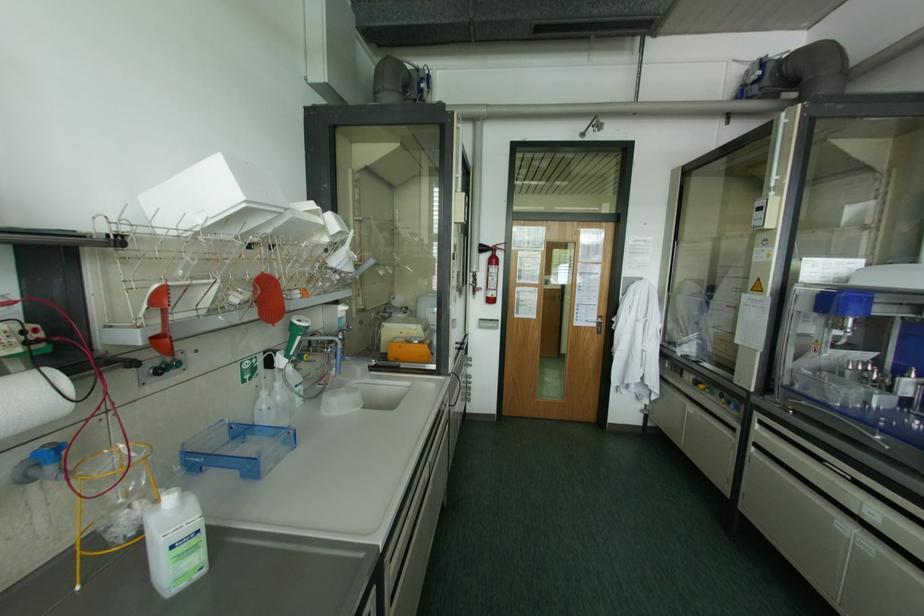
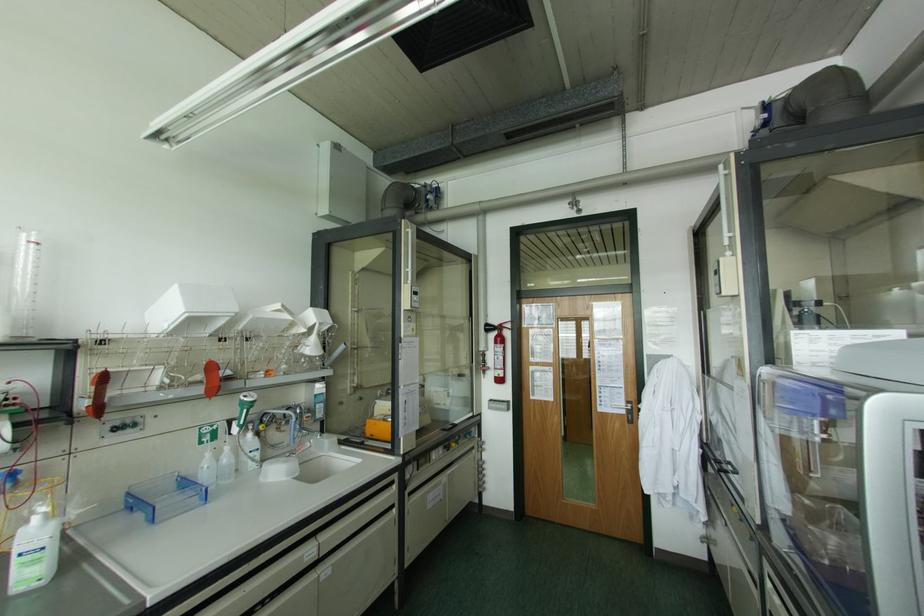
In the second image, find the point that corresponds to [184,453] in the first image.

(128, 493)